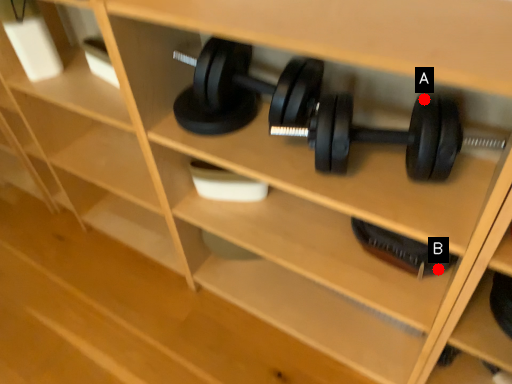
Question: Two points are circled on the image, labeled by A and B beside each circle. Which point is closer to the camera?

Choices:
 (A) A is closer
 (B) B is closer

Answer: (A)